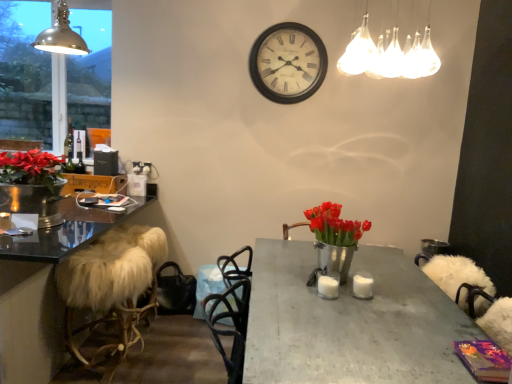
What are the coordinates of `vacant space that is to the left of white matte candle at table center, which appears as the second candle when viewed from the left` in the screenshot? It's located at click(x=339, y=289).